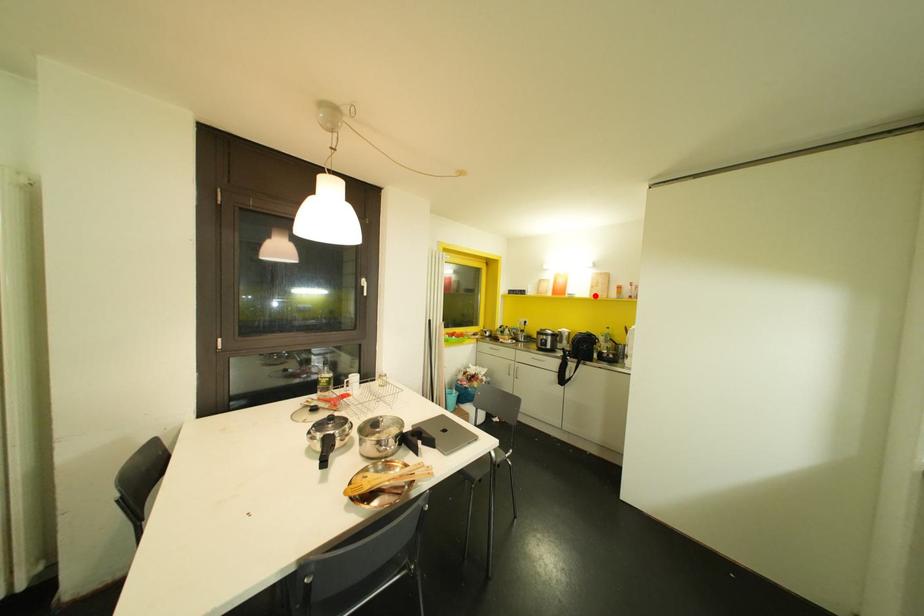
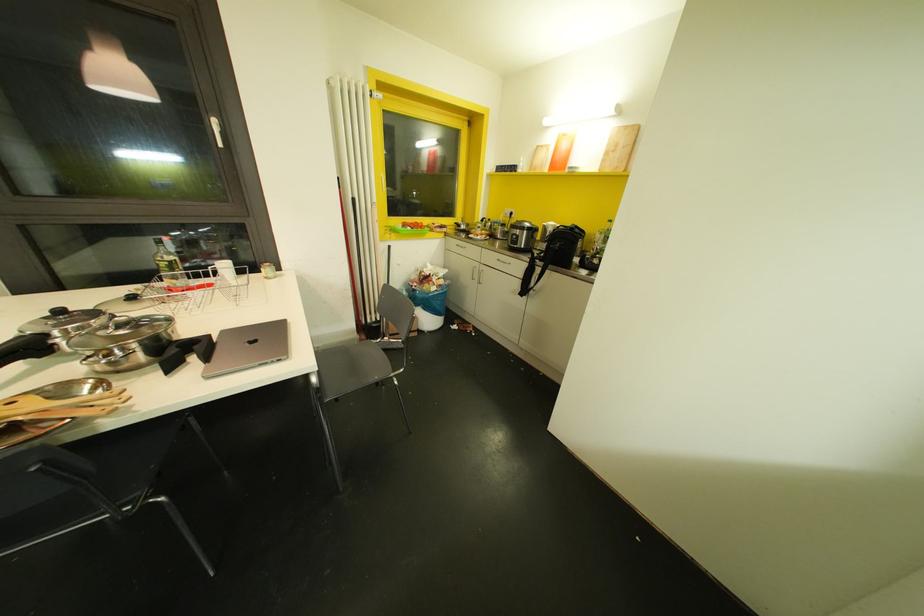
The point at the highlighted location is marked in the first image. Where is the corresponding point in the second image?

(606, 169)